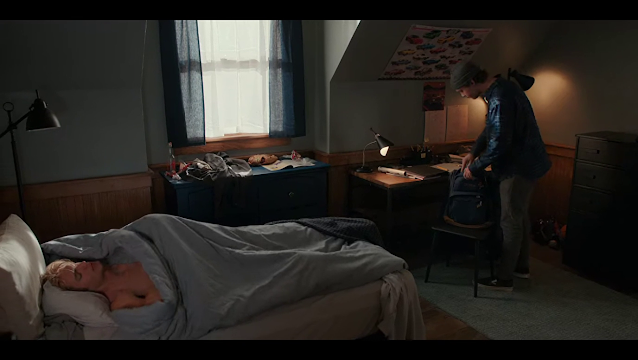
Image resolution: width=638 pixels, height=360 pixels. Find the location of `carpet`. carpet is located at coordinates [519, 318].